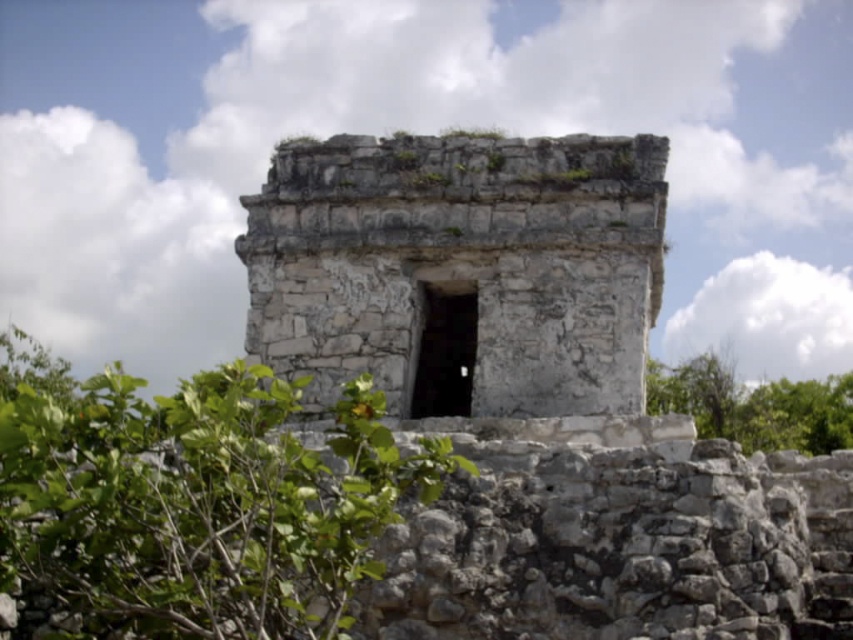
Between white stone ruins at center and green leafy bush at center, which one has less height?

Standing shorter between the two is green leafy bush at center.

Is white stone ruins at center further to the viewer compared to green leafy bush at center?

Yes.

Where is `white stone ruins at center`? The height and width of the screenshot is (640, 853). white stone ruins at center is located at coordinates (460, 269).

Which is behind, point (492, 144) or point (703, 432)?

The point (703, 432) is behind.

Consider the image. Between white stone ruins at center and green leafy tree at lower right, which one appears on the right side from the viewer's perspective?

green leafy tree at lower right is more to the right.

This screenshot has width=853, height=640. Describe the element at coordinates (460, 269) in the screenshot. I see `white stone ruins at center` at that location.

Find the location of a particular element. The height and width of the screenshot is (640, 853). white stone ruins at center is located at coordinates (460, 269).

Who is positioned more to the right, green leafy bush at center or green leafy tree at lower right?

green leafy tree at lower right

Between green leafy bush at center and green leafy tree at lower right, which one appears on the left side from the viewer's perspective?

green leafy bush at center

Where is `green leafy bush at center`? The width and height of the screenshot is (853, 640). green leafy bush at center is located at coordinates (194, 500).